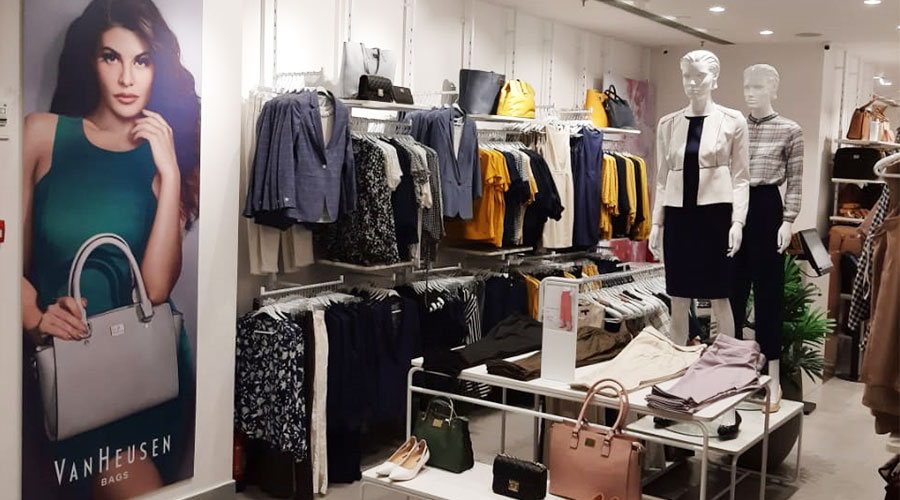
The image size is (900, 500). Find the location of `wall`. wall is located at coordinates (436, 29), (840, 81).